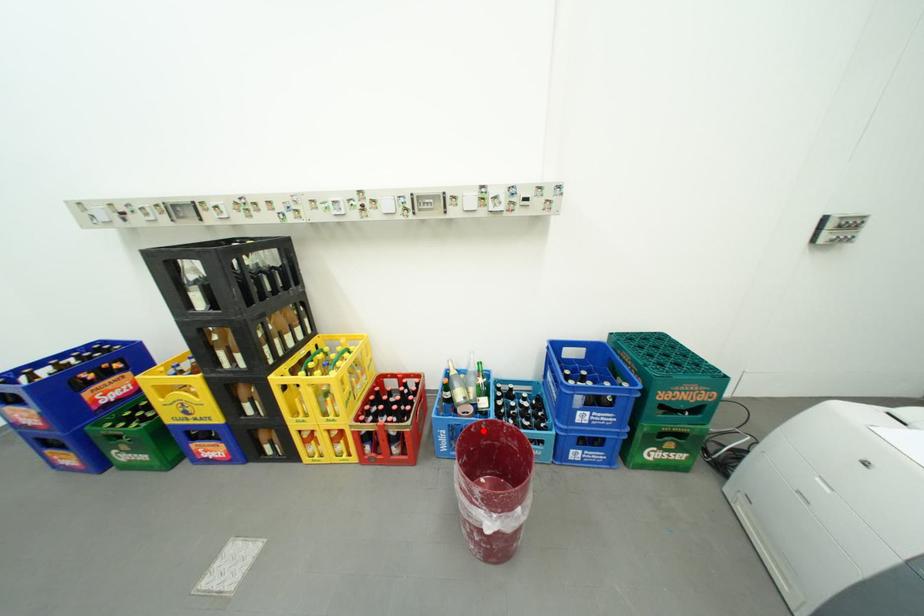
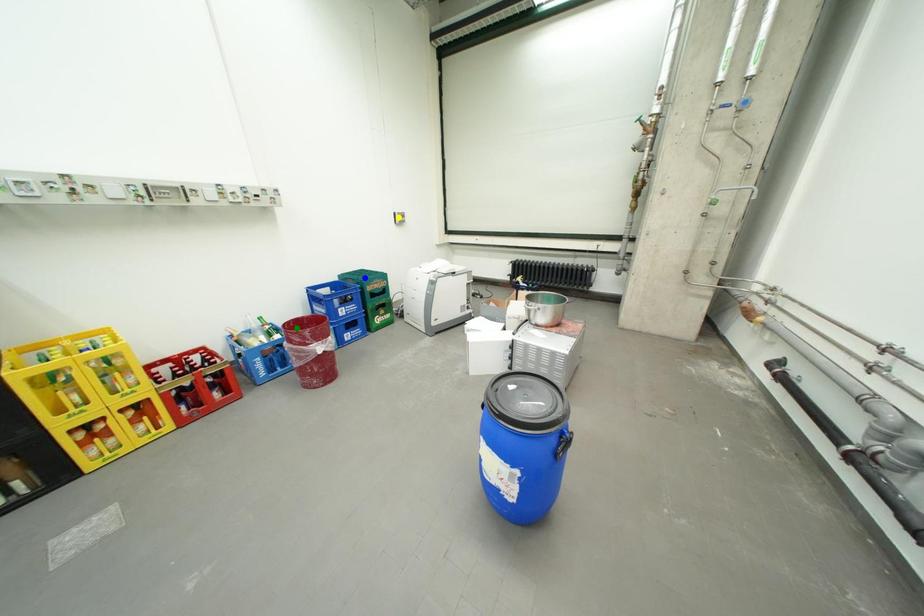
Question: I am providing you with two images of the same scene from different viewpoints. A red point is marked on the first image. You are given multiple points on the second image. Which spot in image 2 lines up with the point in image 1?

Choices:
 (A) green point
 (B) blue point
 (C) yellow point

Answer: (A)